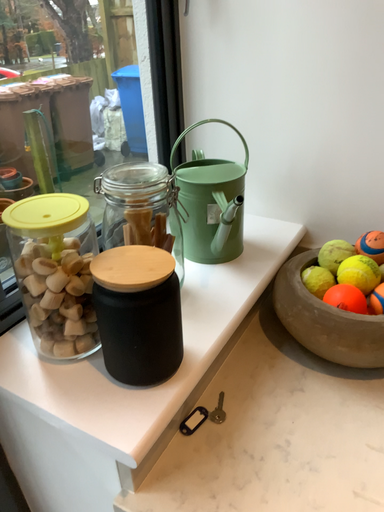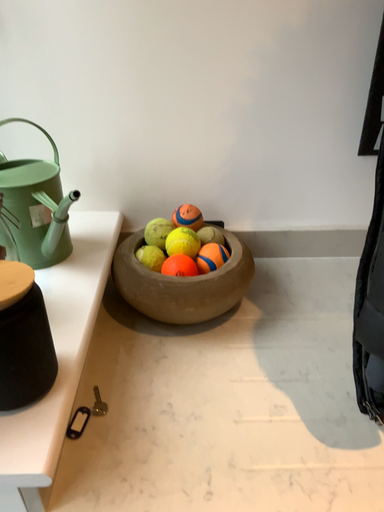
Question: Which way did the camera rotate in the video?

Choices:
 (A) rotated left
 (B) rotated right

Answer: (B)